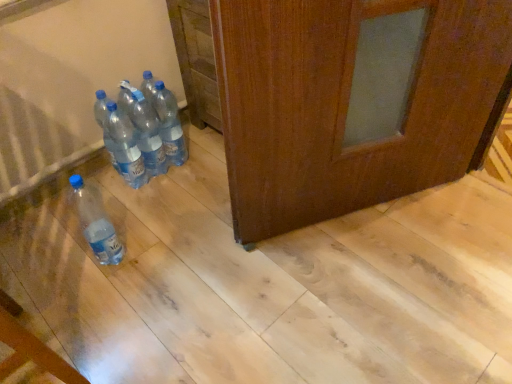
Where is `free space that is in between matte plastic bottle at lower left, which appears as the fourth bottle when viewed from the right, and transparent plastic bottles at center, the first bottle viewed from the right`? The width and height of the screenshot is (512, 384). free space that is in between matte plastic bottle at lower left, which appears as the fourth bottle when viewed from the right, and transparent plastic bottles at center, the first bottle viewed from the right is located at coordinates (145, 206).